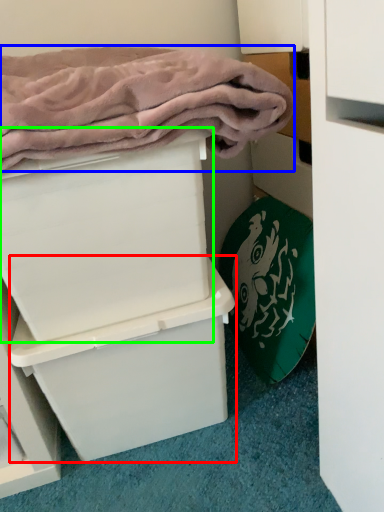
Question: Based on their relative distances, which object is farther from box (highlighted by a red box)? Choose from bath towel (highlighted by a blue box) and box (highlighted by a green box).

Choices:
 (A) bath towel
 (B) box

Answer: (A)